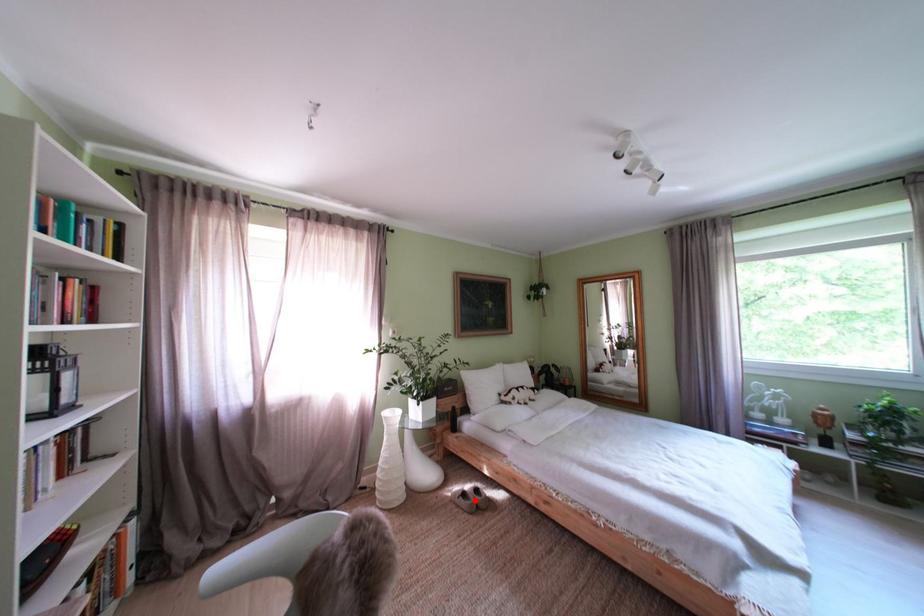
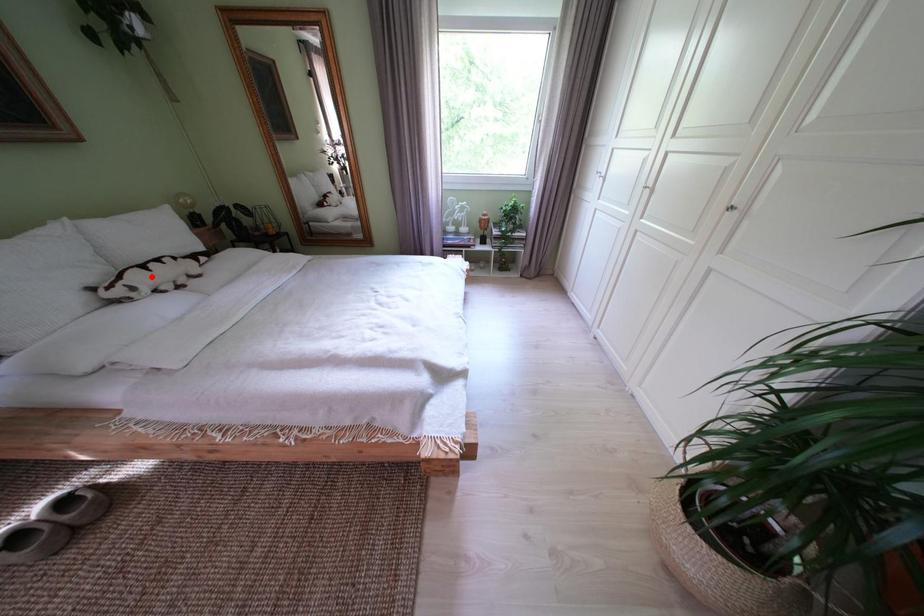
I am providing you with two images of the same scene from different viewpoints. A red point is marked on the first image and another point is marked on the second image. Does the point marked in image1 correspond to the same location as the one in image2?

No